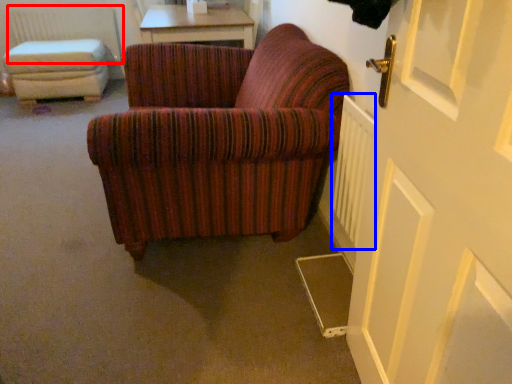
Question: Which object appears closest to the camera in this image, radiator (highlighted by a red box) or radiator (highlighted by a blue box)?

Choices:
 (A) radiator
 (B) radiator

Answer: (B)